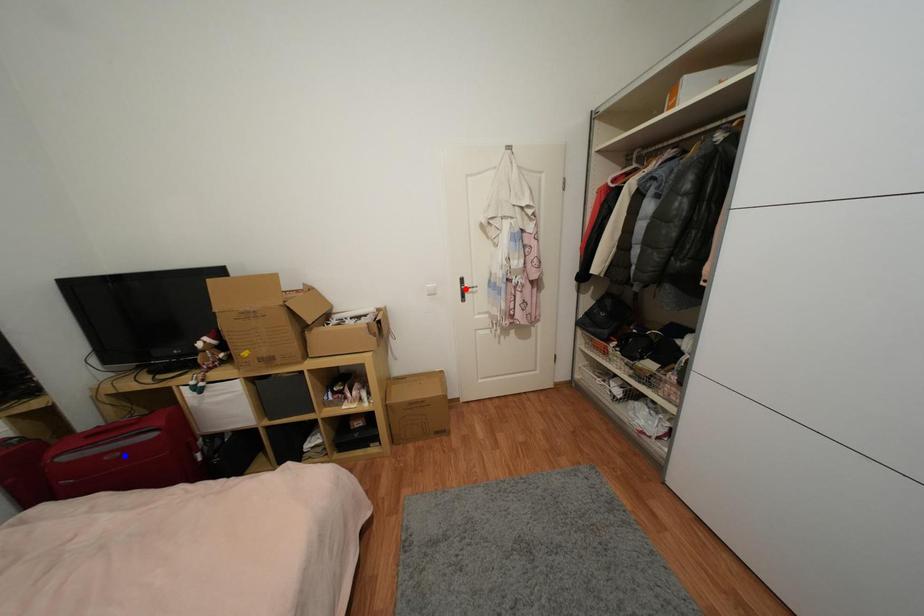
Question: Two points are marked on the image. Which point is closer to the camera?

Choices:
 (A) Blue point is closer.
 (B) Red point is closer.

Answer: (A)